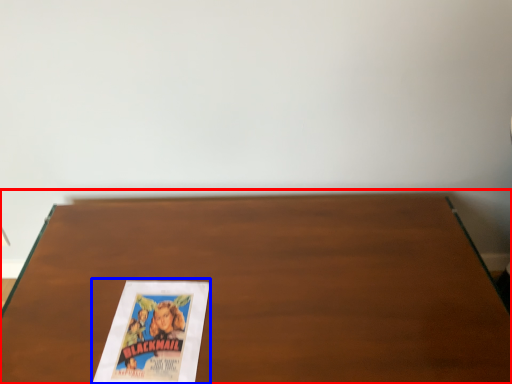
Question: Which point is closer to the camera, table (highlighted by a red box) or paperback book (highlighted by a blue box)?

Choices:
 (A) table
 (B) paperback book

Answer: (B)